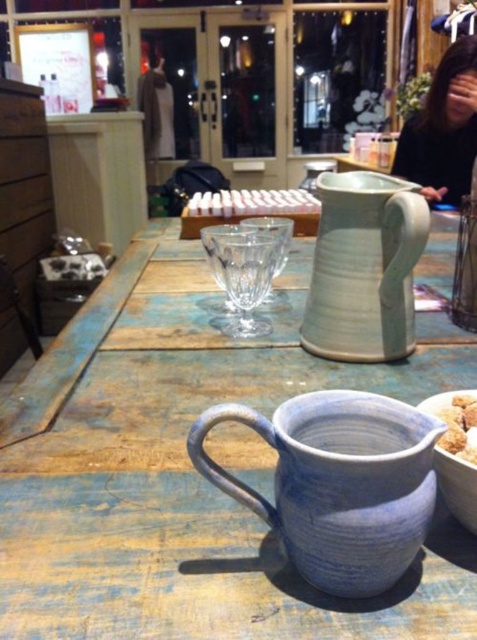
You are standing at the entrance of the cafe and want to place a new menu board between the two points labeled point (78, 456) and point (356, 470). Based on their positions, which point should the menu board be closer to?

The menu board should be closer to point (356, 470) because point (78, 456) is behind it.

You are a barista working at the counter and need to place a 12 inch long cake on the counter. The cake must be placed between the two points marked as point (80, 547). Is there enough space between them to fit the cake?

The distance between the two points marked as point (80, 547) is 14.76 inches, which is longer than the 12 inch cake. Therefore, there is enough space to fit the cake between them.

You are standing at the entrance of the cafe and see the rustic wooden counter with two ceramic pitchers. The blue textured pitcher at center has a point at coordinates (x=190, y=472). Can you tell me what object this point belongs to?

The point at coordinates (x=190, y=472) is located on the blue textured pitcher at center.